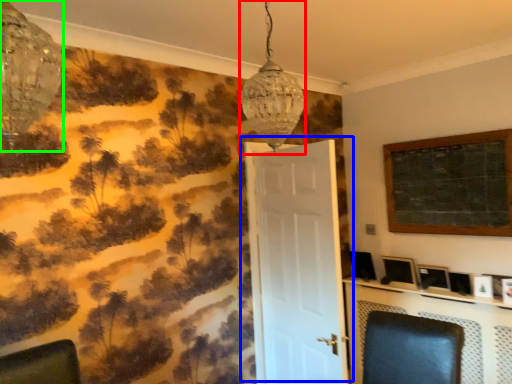
Question: Which object is the closest to the lamp (highlighted by a red box)? Choose among these: door (highlighted by a blue box) or lamp (highlighted by a green box).

Choices:
 (A) door
 (B) lamp

Answer: (B)